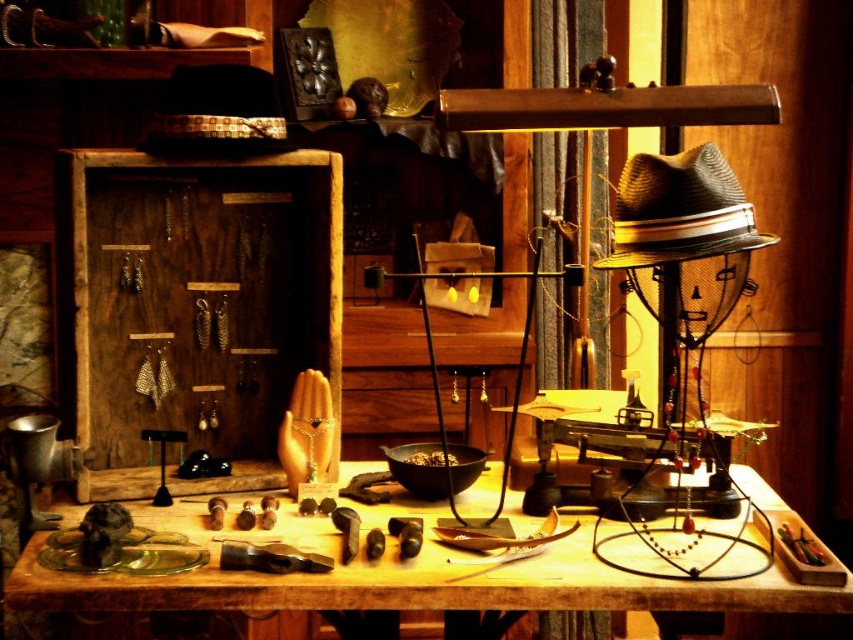
Question: Does wooden jewelry display at upper left have a smaller size compared to wooden table at center?

Choices:
 (A) no
 (B) yes

Answer: (B)

Question: Is wooden table at center positioned in front of woven straw cowboy hat at upper right?

Choices:
 (A) yes
 (B) no

Answer: (A)

Question: Which object is farther from the camera taking this photo?

Choices:
 (A) wooden table at center
 (B) wooden jewelry display at upper left

Answer: (B)

Question: Does wooden jewelry display at upper left have a greater width compared to wooden table at center?

Choices:
 (A) yes
 (B) no

Answer: (B)

Question: Among these objects, which one is nearest to the camera?

Choices:
 (A) wooden table at center
 (B) woven straw cowboy hat at upper right

Answer: (A)

Question: Which point is farther to the camera?

Choices:
 (A) (44, 534)
 (B) (154, 481)
 (C) (665, 168)

Answer: (B)